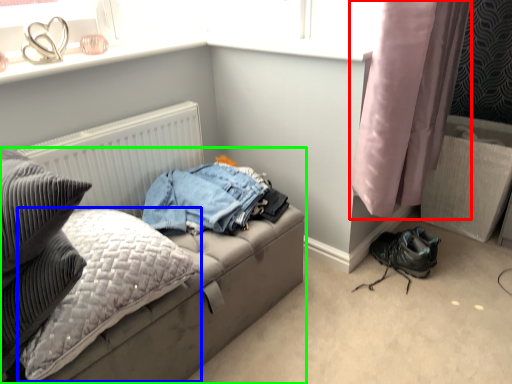
Question: Considering the real-world distances, which object is closest to curtain (highlighted by a red box)? pillow (highlighted by a blue box) or studio couch (highlighted by a green box).

Choices:
 (A) pillow
 (B) studio couch

Answer: (B)